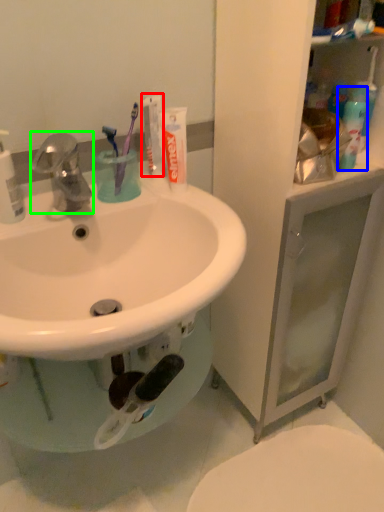
Question: Estimate the real-world distances between objects in this image. Which object is farther from toothpaste (highlighted by a red box), cleaning product (highlighted by a blue box) or tap (highlighted by a green box)?

Choices:
 (A) cleaning product
 (B) tap

Answer: (A)